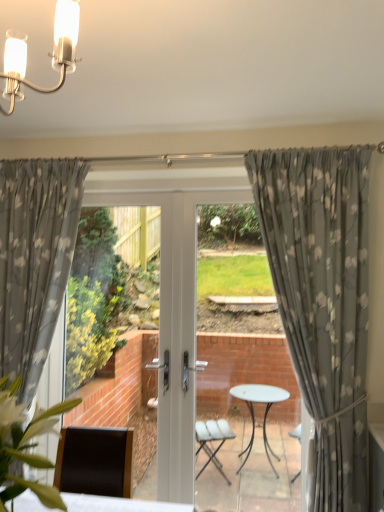
Question: Is white glossy light fixture at upper left inside the boundaries of gray floral fabric curtain at center, the first curtain viewed from the right, or outside?

Choices:
 (A) inside
 (B) outside

Answer: (B)

Question: From a real-world perspective, relative to gray floral fabric curtain at center, the first curtain viewed from the right, is white glossy light fixture at upper left vertically above or below?

Choices:
 (A) below
 (B) above

Answer: (B)

Question: Which object is positioned farthest from the green leafy plant at lower left?

Choices:
 (A) white glossy light fixture at upper left
 (B) gray floral curtain at left, which ranks as the 2th curtain in right-to-left order
 (C) gray floral fabric curtain at center, which is counted as the 2th curtain, starting from the left

Answer: (C)

Question: Estimate the real-world distances between objects in this image. Which object is farther from the gray floral curtain at left, which ranks as the 2th curtain in right-to-left order?

Choices:
 (A) gray floral fabric curtain at center, which is counted as the 2th curtain, starting from the left
 (B) green leafy plant at lower left
 (C) white glossy light fixture at upper left

Answer: (C)